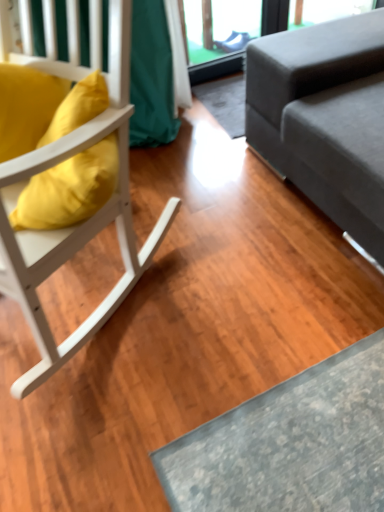
I want to click on matte yellow pillow at left, so click(x=69, y=189).

Measure the distance between gray fabric couch at right and camera.

They are 4.00 feet apart.

Find the location of a particular element. The height and width of the screenshot is (512, 384). matte yellow pillow at left is located at coordinates (69, 189).

Is the depth of matte yellow pillow at left greater than that of gray fabric couch at right?

Yes, matte yellow pillow at left is further from the viewer.

Consider the image. Could you tell me if matte yellow pillow at left is facing gray fabric couch at right?

No, matte yellow pillow at left is not oriented towards gray fabric couch at right.

Locate an element on the screen. The width and height of the screenshot is (384, 512). pillow above the gray fabric couch at right (from a real-world perspective) is located at coordinates (69, 189).

From the image's perspective, is matte yellow pillow at left under gray fabric couch at right?

Correct, matte yellow pillow at left appears lower than gray fabric couch at right in the image.

Would you say white wood chair at left is to the left or to the right of matte yellow pillow at left in the picture?

Clearly, white wood chair at left is on the right of matte yellow pillow at left in the image.

What's the angular difference between white wood chair at left and matte yellow pillow at left's facing directions?

They differ by 64.8 degrees in their facing directions.

Is the depth of white wood chair at left greater than that of matte yellow pillow at left?

No, white wood chair at left is in front of matte yellow pillow at left.

Relative to gray fabric couch at right, is white wood chair at left in front or behind?

white wood chair at left is positioned closer to the viewer than gray fabric couch at right.

Considering the relative sizes of white wood chair at left and gray fabric couch at right in the image provided, is white wood chair at left thinner than gray fabric couch at right?

Correct, the width of white wood chair at left is less than that of gray fabric couch at right.

From a real-world perspective, does white wood chair at left stand above gray fabric couch at right?

Yes, from a real-world perspective, white wood chair at left is above gray fabric couch at right.

Who is taller, white wood chair at left or gray fabric couch at right?

white wood chair at left is taller.

Which object is closer to the camera, matte yellow pillow at left or white wood chair at left?

white wood chair at left.

From the image's perspective, does matte yellow pillow at left appear higher than white wood chair at left?

Correct, matte yellow pillow at left appears higher than white wood chair at left in the image.

Is matte yellow pillow at left far away from white wood chair at left?

matte yellow pillow at left is actually quite close to white wood chair at left.

How many degrees apart are the facing directions of matte yellow pillow at left and white wood chair at left?

They differ by 64.8 degrees in their facing directions.

Is gray fabric couch at right oriented away from matte yellow pillow at left?

gray fabric couch at right does not have its back to matte yellow pillow at left.

From a real-world perspective, is gray fabric couch at right positioned above or below matte yellow pillow at left?

From a real-world perspective, gray fabric couch at right is physically below matte yellow pillow at left.

Based on the photo, is gray fabric couch at right shorter than white wood chair at left?

Indeed, gray fabric couch at right has a lesser height compared to white wood chair at left.

The image size is (384, 512). Find the location of `studio couch below the white wood chair at left (from a real-world perspective)`. studio couch below the white wood chair at left (from a real-world perspective) is located at coordinates (325, 117).

Is white wood chair at left at the back of gray fabric couch at right?

That's not correct — gray fabric couch at right is not looking away from white wood chair at left.

How different are the orientations of gray fabric couch at right and white wood chair at left in degrees?

The angular difference between gray fabric couch at right and white wood chair at left is 32.9 degrees.

The height and width of the screenshot is (512, 384). Find the location of `studio couch beneath the matte yellow pillow at left (from a real-world perspective)`. studio couch beneath the matte yellow pillow at left (from a real-world perspective) is located at coordinates (325, 117).

What are the coordinates of `pillow above the white wood chair at left (from the image's perspective)` in the screenshot? It's located at (69, 189).

Consider the image. Based on their spatial positions, is white wood chair at left or gray fabric couch at right further from matte yellow pillow at left?

gray fabric couch at right is further to matte yellow pillow at left.

Looking at this image, when comparing their distances from gray fabric couch at right, does matte yellow pillow at left or white wood chair at left seem further?

matte yellow pillow at left is further to gray fabric couch at right.

Estimate the real-world distances between objects in this image. Which object is closer to gray fabric couch at right, white wood chair at left or matte yellow pillow at left?

white wood chair at left lies closer to gray fabric couch at right than the other object.

Considering their positions, is matte yellow pillow at left positioned closer to white wood chair at left than gray fabric couch at right?

Among the two, matte yellow pillow at left is located nearer to white wood chair at left.

In the scene shown: Considering their positions, is gray fabric couch at right positioned closer to matte yellow pillow at left than white wood chair at left?

Based on the image, white wood chair at left appears to be nearer to matte yellow pillow at left.

Based on their spatial positions, is gray fabric couch at right or matte yellow pillow at left further from white wood chair at left?

gray fabric couch at right.

At what (x,y) coordinates should I click in order to perform the action: click on chair located between matte yellow pillow at left and gray fabric couch at right in the left-right direction. Please return your answer as a coordinate pair (x, y). Looking at the image, I should click on (79, 224).